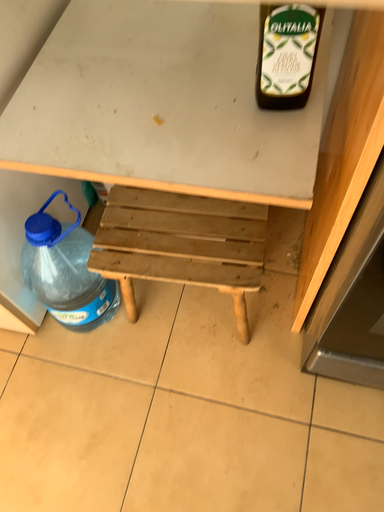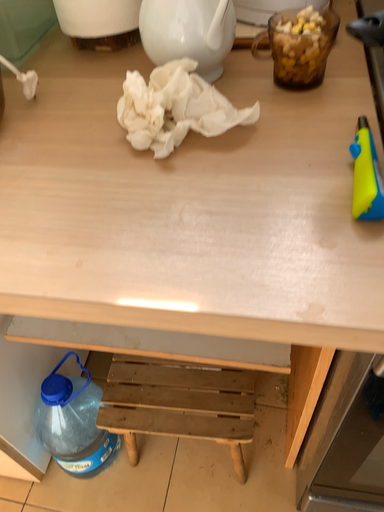
Question: How did the camera likely rotate when shooting the video?

Choices:
 (A) rotated upward
 (B) rotated downward

Answer: (A)